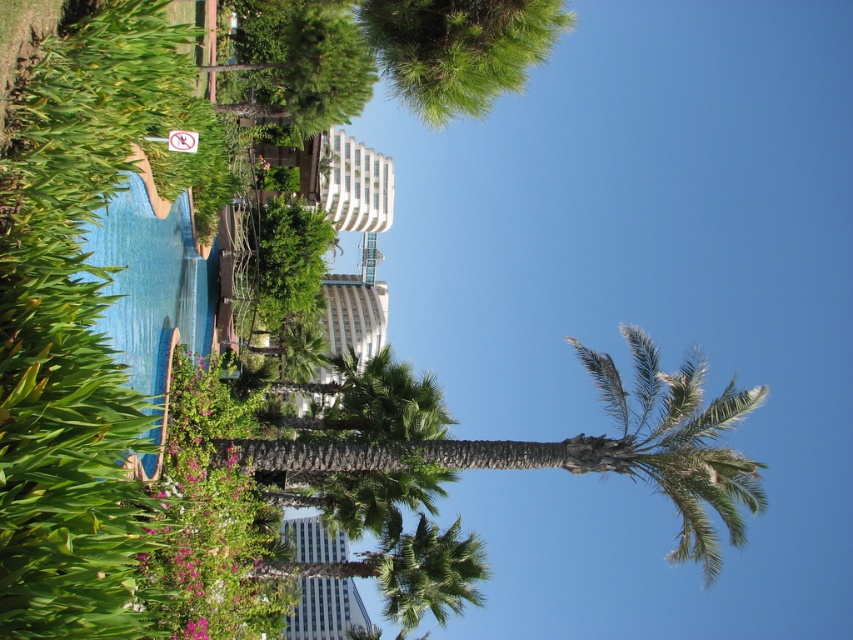
Question: Which of the following is the farthest from the observer?

Choices:
 (A) green textured palm tree at center
 (B) green leafy palm tree at center

Answer: (B)

Question: Which point is closer to the camera?

Choices:
 (A) (737, 532)
 (B) (418, 531)

Answer: (A)

Question: Can you confirm if green textured palm tree at center is positioned to the left of white plastic sign at upper center?

Choices:
 (A) no
 (B) yes

Answer: (A)

Question: Which point appears farthest from the camera in this image?

Choices:
 (A) (473, 596)
 (B) (671, 436)
 (C) (190, 150)

Answer: (A)

Question: Is green leafy palm tree at center wider than white plastic sign at upper center?

Choices:
 (A) no
 (B) yes

Answer: (B)

Question: In this image, where is green textured palm tree at center located relative to white plastic sign at upper center?

Choices:
 (A) left
 (B) right

Answer: (B)